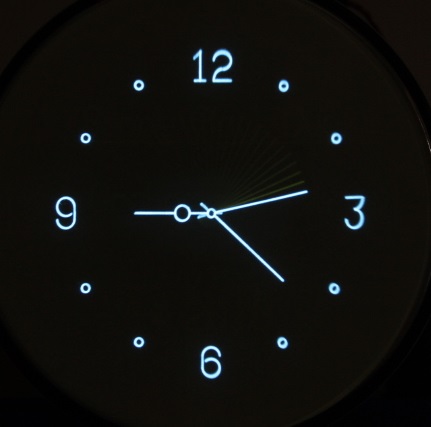
Identify the location of charcoal black round clockface. (200, 57), (200, 266).